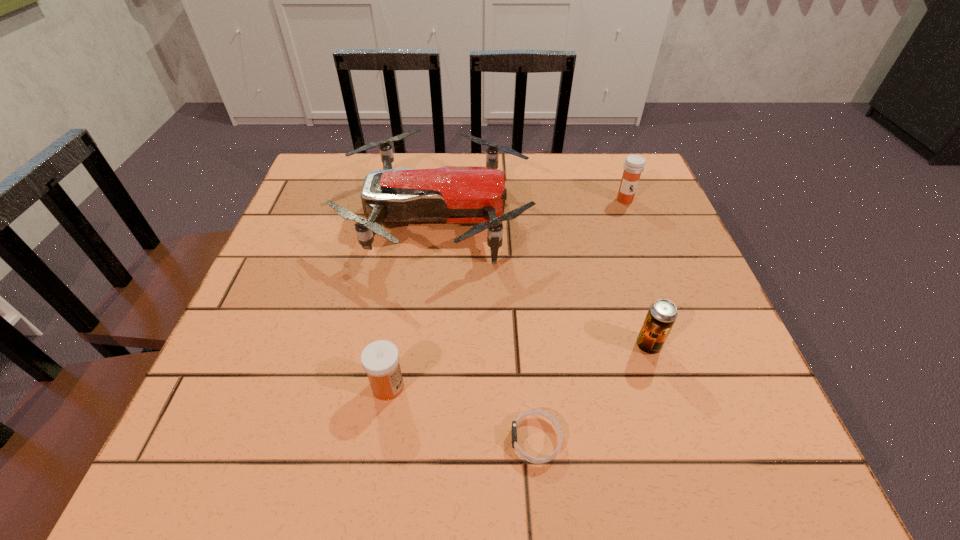
Where is `object that can be found as the second closest to the third farthest object`? The image size is (960, 540). object that can be found as the second closest to the third farthest object is located at coordinates (453, 194).

Identify which object is located as the second nearest to the nearest object. Please provide its 2D coordinates. Your answer should be formatted as a tuple, i.e. [(x, y)], where the tuple contains the x and y coordinates of a point satisfying the conditions above.

[(662, 314)]

You are a GUI agent. You are given a task and a screenshot of the screen. Output one action in this format:
    pyautogui.click(x=<x>, y=<y>)
    Task: Click on the vacant space that satisfies the following two spatial constraints: 1. on the back side of the beer can; 2. on the front-facing side of the drone
    Image resolution: width=960 pixels, height=540 pixels.
    Given the screenshot: What is the action you would take?
    pyautogui.click(x=607, y=217)

Locate an element on the screen. Image resolution: width=960 pixels, height=540 pixels. vacant point that satisfies the following two spatial constraints: 1. on the label side of the rightmost object; 2. on the outer surface of the wristband is located at coordinates (716, 440).